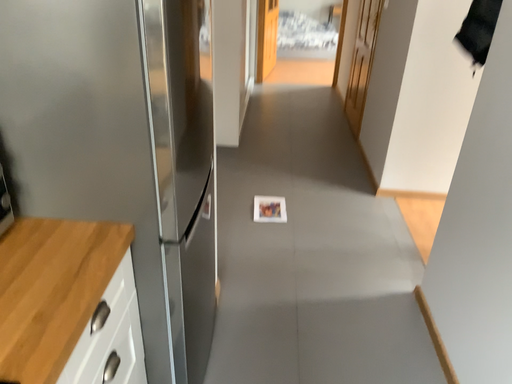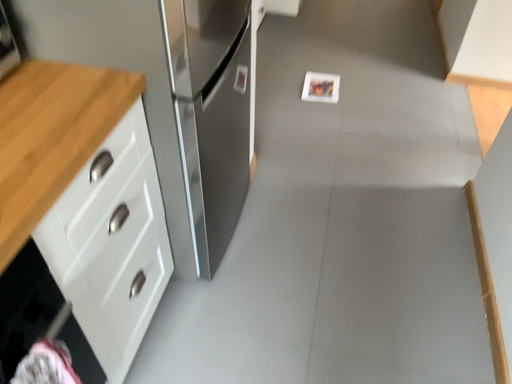
Question: Which way did the camera rotate in the video?

Choices:
 (A) rotated downward
 (B) rotated upward

Answer: (A)